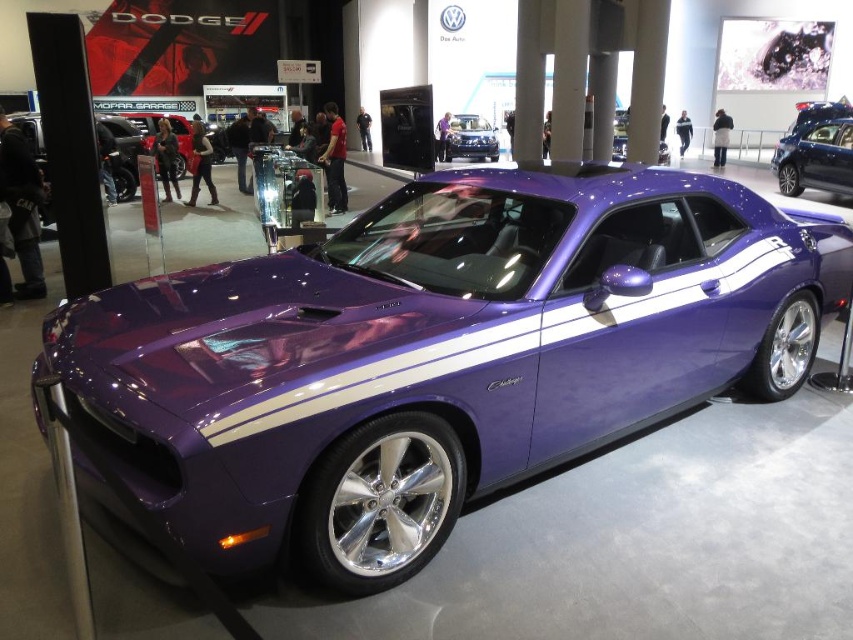
Question: Observing the image, what is the correct spatial positioning of shiny purple car at center in reference to purple glossy dodge challenger at center?

Choices:
 (A) above
 (B) below

Answer: (B)

Question: Estimate the real-world distances between objects in this image. Which object is farther from the glossy purple car at center?

Choices:
 (A) shiny purple car at center
 (B) purple glossy dodge challenger at center

Answer: (A)

Question: Estimate the real-world distances between objects in this image. Which object is closer to the purple glossy dodge challenger at center?

Choices:
 (A) shiny purple car at center
 (B) glossy purple car at center

Answer: (B)

Question: Is shiny purple car at center to the right of glossy purple car at center from the viewer's perspective?

Choices:
 (A) yes
 (B) no

Answer: (B)

Question: Which object is positioned closest to the glossy purple car at center?

Choices:
 (A) purple glossy dodge challenger at center
 (B) shiny purple car at center

Answer: (A)

Question: Is glossy purple car at center to the right of purple glossy dodge challenger at center from the viewer's perspective?

Choices:
 (A) yes
 (B) no

Answer: (A)